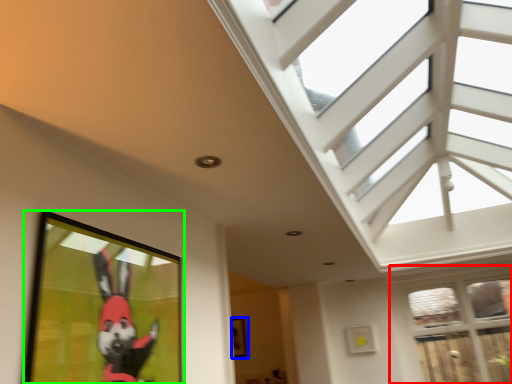
Question: Which object is the closest to the window (highlighted by a red box)? Choose among these: picture frame (highlighted by a blue box) or picture frame (highlighted by a green box).

Choices:
 (A) picture frame
 (B) picture frame

Answer: (A)